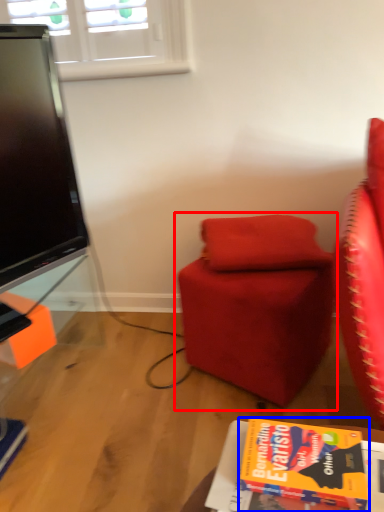
Question: Which object is further to the camera taking this photo, chair (highlighted by a red box) or book (highlighted by a blue box)?

Choices:
 (A) chair
 (B) book

Answer: (A)